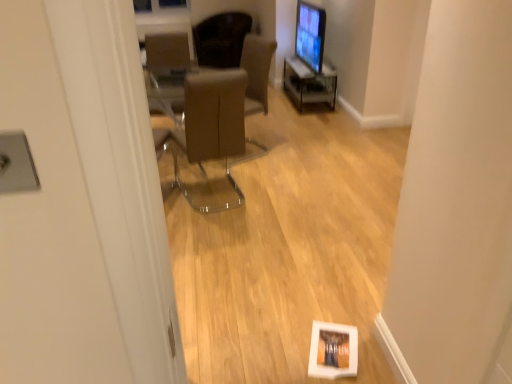
Find the location of a particular element. The height and width of the screenshot is (384, 512). vacant space to the right of brown leather chair at center, the third chair positioned from the top is located at coordinates (274, 190).